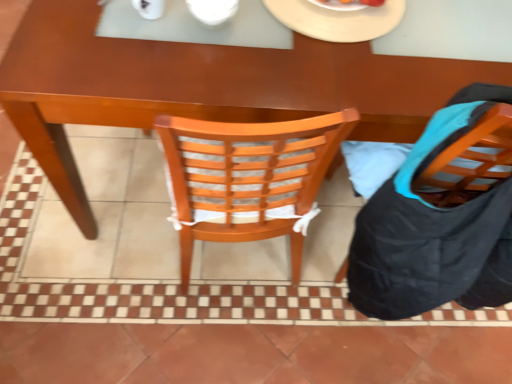
Locate an element on the screen. The height and width of the screenshot is (384, 512). vacant space to the left of white glossy bowl at upper center is located at coordinates (128, 27).